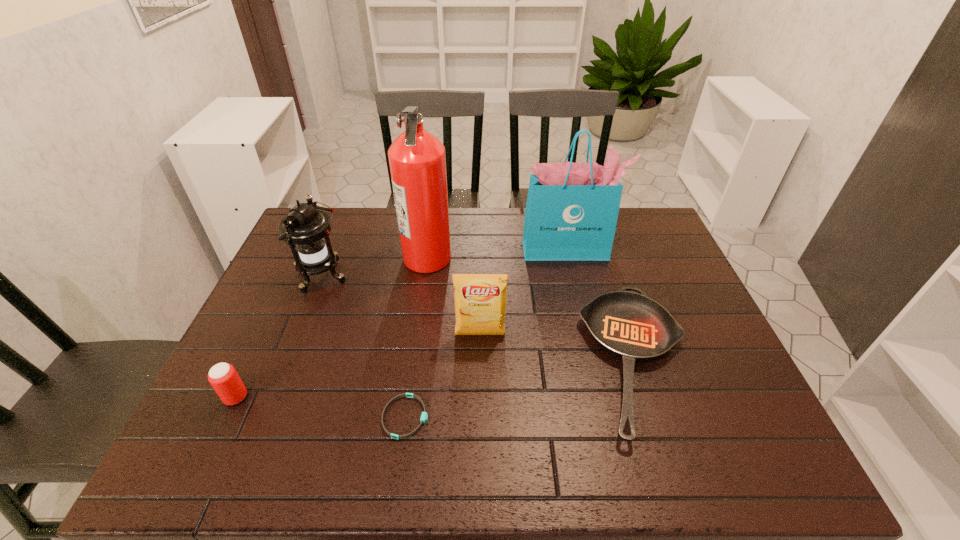
Find the location of a particular element. The height and width of the screenshot is (540, 960). beer can that is positioned at the left edge is located at coordinates (223, 377).

The image size is (960, 540). Identify the location of object that is at the right edge. (632, 326).

Where is `object situated at the near right corner`? The image size is (960, 540). object situated at the near right corner is located at coordinates (632, 326).

Where is `vacant space at the near edge of the desktop`? Image resolution: width=960 pixels, height=540 pixels. vacant space at the near edge of the desktop is located at coordinates (408, 456).

Locate an element on the screen. The height and width of the screenshot is (540, 960). free region at the left edge of the desktop is located at coordinates (339, 251).

Where is `free space at the right edge of the desktop`? free space at the right edge of the desktop is located at coordinates (689, 295).

You are a GUI agent. You are given a task and a screenshot of the screen. Output one action in this format:
    pyautogui.click(x=<x>, y=<y>)
    Task: Click on the free space at the far right corner of the desktop
    
    Given the screenshot: What is the action you would take?
    pyautogui.click(x=623, y=250)

This screenshot has height=540, width=960. I want to click on free space at the near right corner, so (723, 438).

Identify the location of unoccupied area between the tallest object and the frying pan. (532, 309).

Where is `free spot between the third tallest object and the fifth tallest object`? free spot between the third tallest object and the fifth tallest object is located at coordinates (278, 337).